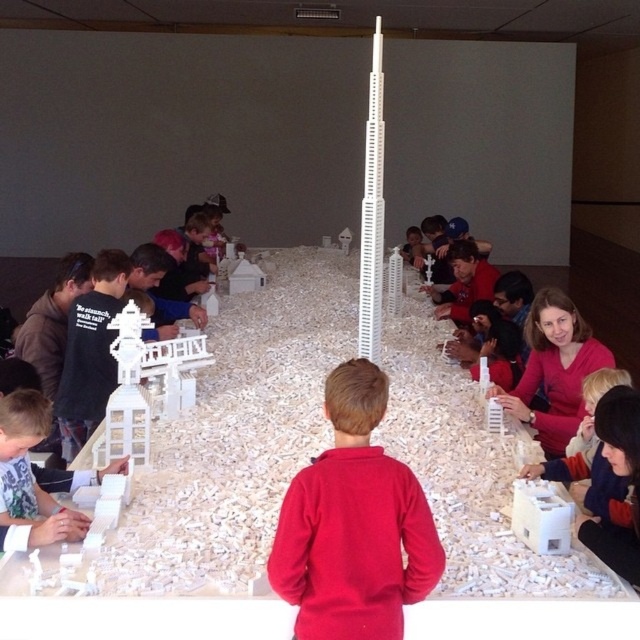
Can you confirm if red fleece sweater at center is smaller than white matte tower at center?

Indeed, red fleece sweater at center has a smaller size compared to white matte tower at center.

Does point (355, 392) come closer to viewer compared to point (577, 424)?

That is True.

What do you see at coordinates (353, 524) in the screenshot? This screenshot has height=640, width=640. I see `red fleece sweater at center` at bounding box center [353, 524].

Locate an element on the screen. The height and width of the screenshot is (640, 640). red fleece sweater at center is located at coordinates (353, 524).